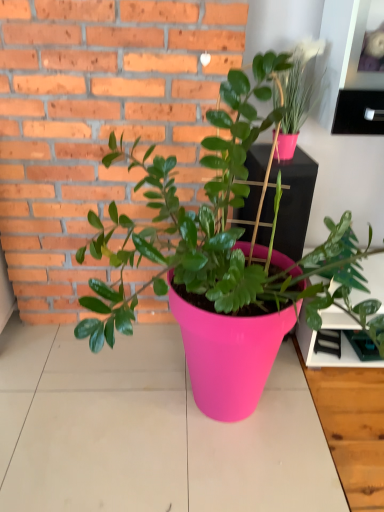
Find the location of a particular element. The image size is (384, 512). blank space situated above pink plastic shelf at upper right (from a real-world perspective) is located at coordinates (363, 82).